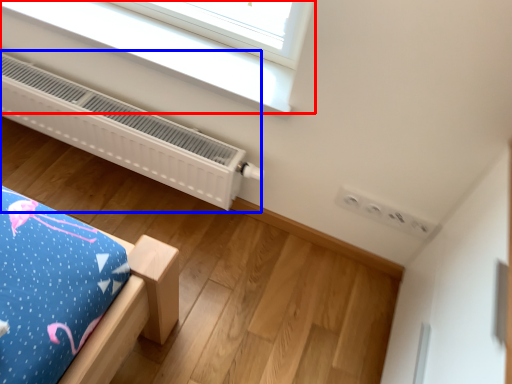
Question: Among these objects, which one is nearest to the camera, window (highlighted by a red box) or heater (highlighted by a blue box)?

Choices:
 (A) window
 (B) heater

Answer: (A)